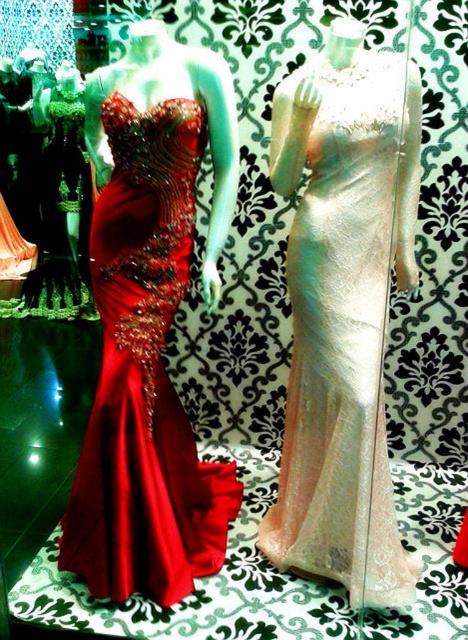
Consider the image. Does iridescent satin gown at center have a lesser height compared to shiny satin gown at left?

No, iridescent satin gown at center is not shorter than shiny satin gown at left.

Which of these two, iridescent satin gown at center or shiny satin gown at left, stands taller?

iridescent satin gown at center is taller.

The height and width of the screenshot is (640, 468). What are the coordinates of `iridescent satin gown at center` in the screenshot? It's located at (343, 310).